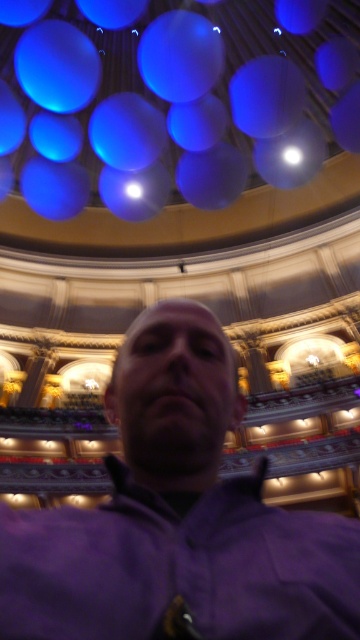
Question: Does purple matte jacket at center have a greater width compared to blue glossy balloon at upper center?

Choices:
 (A) no
 (B) yes

Answer: (A)

Question: Observing the image, what is the correct spatial positioning of purple matte jacket at center in reference to blue glossy balloon at upper center?

Choices:
 (A) below
 (B) above

Answer: (A)

Question: Observing the image, what is the correct spatial positioning of purple matte jacket at center in reference to blue glossy balloon at upper center?

Choices:
 (A) below
 (B) above

Answer: (A)

Question: Which point is farther to the camera?

Choices:
 (A) blue glossy balloon at upper center
 (B) purple matte jacket at center

Answer: (A)